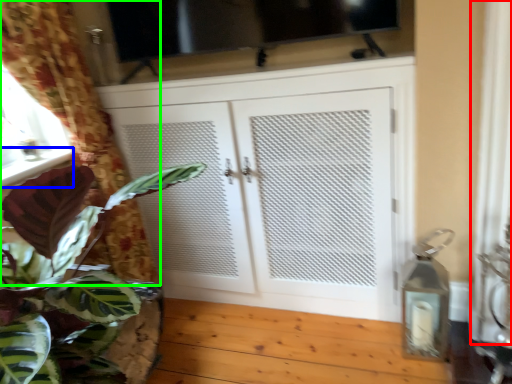
Question: Which is farther away from curtain (highlighted by a red box)? window sill (highlighted by a blue box) or curtain (highlighted by a green box)?

Choices:
 (A) window sill
 (B) curtain

Answer: (A)